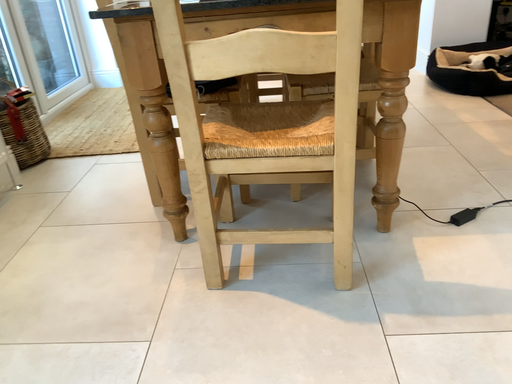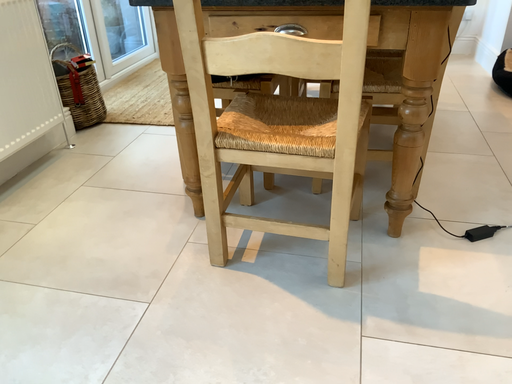
Question: How did the camera likely rotate when shooting the video?

Choices:
 (A) rotated right
 (B) rotated left

Answer: (B)